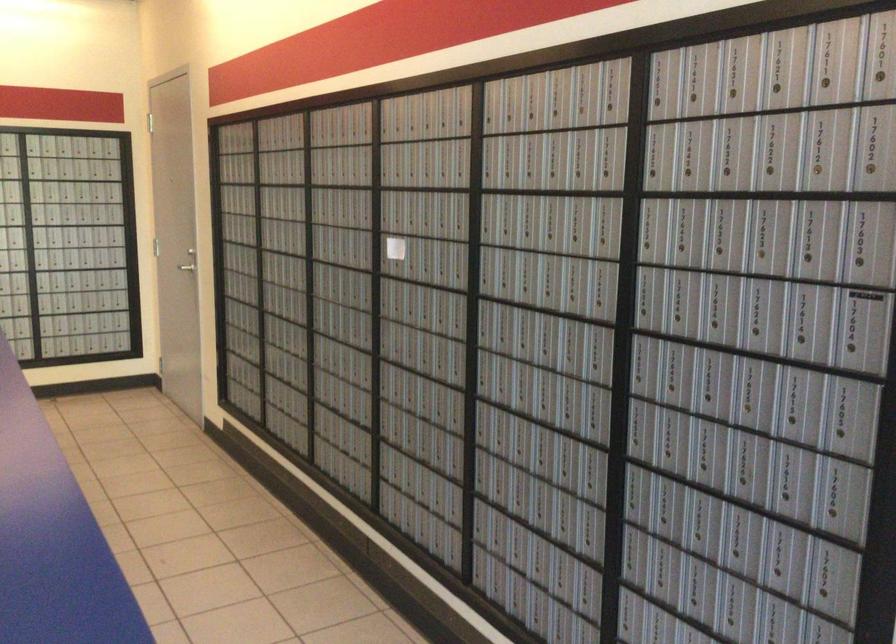
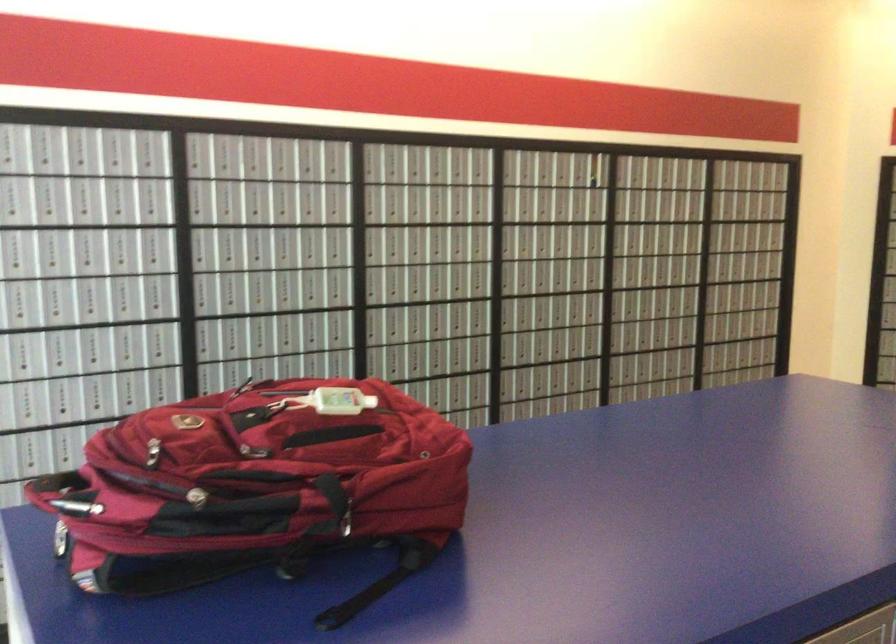
Question: The camera is either moving clockwise (left) or counter-clockwise (right) around the object. The first image is from the beginning of the video and the second image is from the end. Is the camera moving left or right when shooting the video?

Choices:
 (A) Left
 (B) Right

Answer: (B)